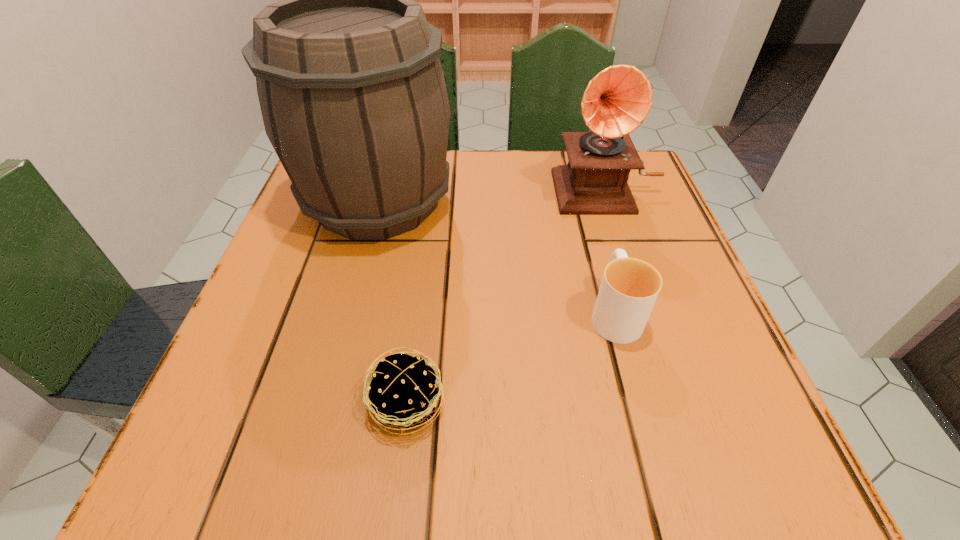
Identify the location of the tallest object. (352, 92).

You are a GUI agent. You are given a task and a screenshot of the screen. Output one action in this format:
    pyautogui.click(x=<x>, y=<y>)
    Task: Click on the third shortest object
    
    Given the screenshot: What is the action you would take?
    pyautogui.click(x=617, y=100)

Find the location of a particular element. the third tallest object is located at coordinates (629, 288).

Locate an element on the screen. This screenshot has height=540, width=960. cup is located at coordinates (629, 288).

Find the location of a particular element. the shortest object is located at coordinates (403, 394).

Where is `the nearest object`? the nearest object is located at coordinates (403, 394).

Identify the location of free region located on the right of the wine bucket. This screenshot has height=540, width=960. (649, 201).

Find the location of `vacant space located 0.350m on the horn of the phonograph record`. vacant space located 0.350m on the horn of the phonograph record is located at coordinates (666, 367).

Locate an element on the screen. free space located with the handle on the side of the cup is located at coordinates (578, 180).

Find the location of `vacant region located 0.050m with the handle on the side of the cup`. vacant region located 0.050m with the handle on the side of the cup is located at coordinates (601, 263).